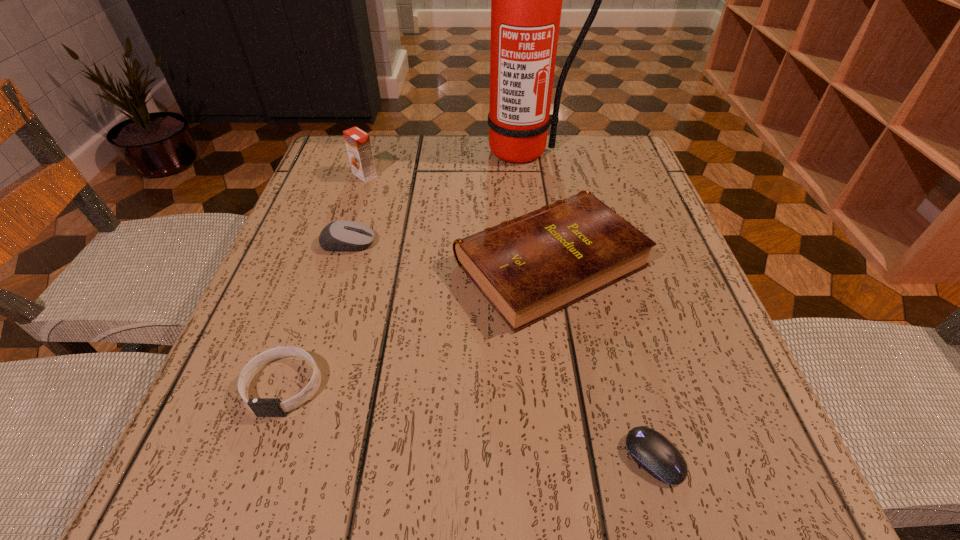
Identify the location of computer equipment present at the left edge. The image size is (960, 540). (343, 235).

Where is `wristband that is at the left edge`? wristband that is at the left edge is located at coordinates (262, 407).

Locate an element on the screen. The height and width of the screenshot is (540, 960). fire extinguisher located at the right edge is located at coordinates (526, 0).

Locate an element on the screen. hardback book that is at the right edge is located at coordinates (532, 266).

The width and height of the screenshot is (960, 540). I want to click on computer mouse present at the right edge, so click(x=648, y=448).

Locate an element on the screen. The width and height of the screenshot is (960, 540). object that is at the far left corner is located at coordinates pos(358,145).

Locate an element on the screen. The height and width of the screenshot is (540, 960). object situated at the far right corner is located at coordinates (526, 0).

At what (x,y) coordinates should I click in order to perform the action: click on object positioned at the near right corner. Please return your answer as a coordinate pair (x, y). Looking at the image, I should click on (648, 448).

The width and height of the screenshot is (960, 540). In order to click on vacant space at the far edge in this screenshot , I will do `click(408, 177)`.

Find the location of a particular element. Image resolution: width=960 pixels, height=540 pixels. free space at the near edge of the desktop is located at coordinates (429, 454).